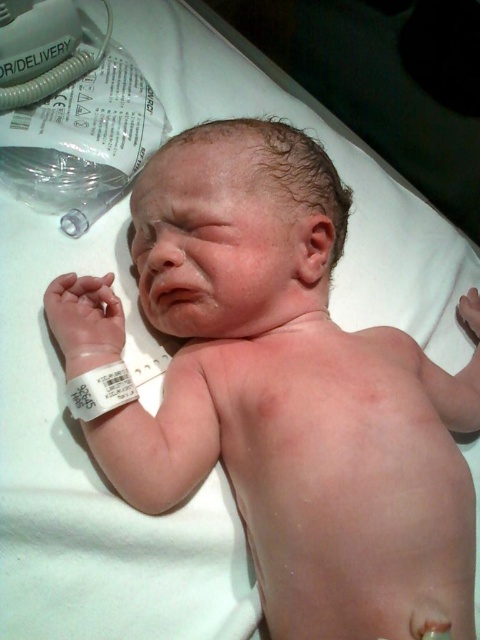
Who is more forward, (319, 429) or (71, 408)?

Point (319, 429) is more forward.

Does point (188, 472) come in front of point (67, 384)?

No, it is behind (67, 384).

This screenshot has width=480, height=640. Describe the element at coordinates (292, 396) in the screenshot. I see `smooth skin newborn at center` at that location.

Where is `smooth skin newborn at center`? This screenshot has width=480, height=640. smooth skin newborn at center is located at coordinates (292, 396).